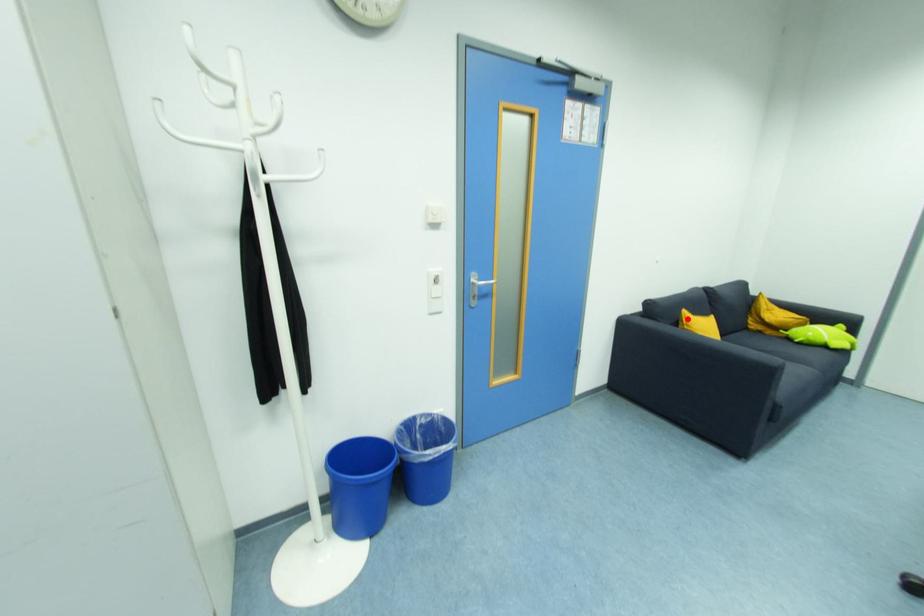
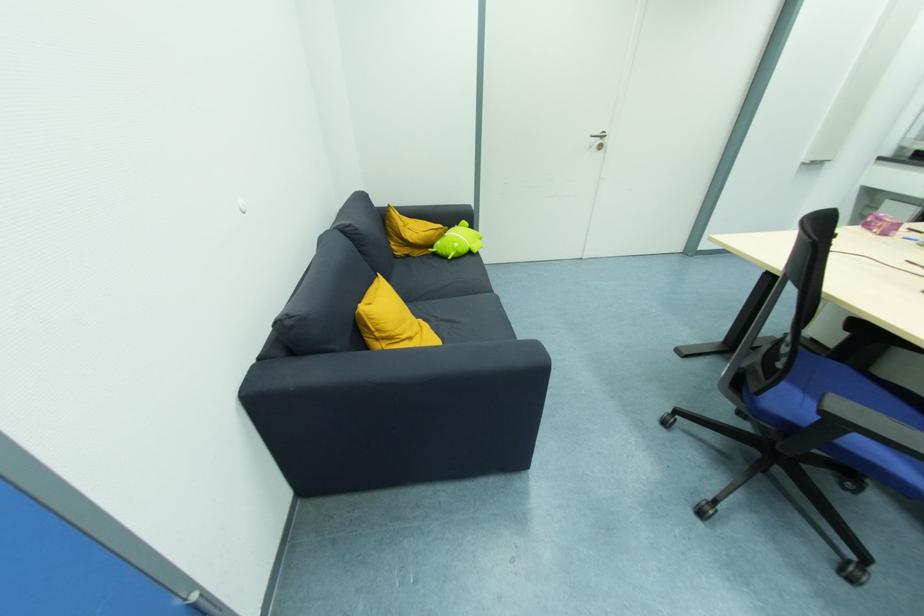
Where in the second image is the point corresponding to the highlighted location from the first image?

(372, 321)